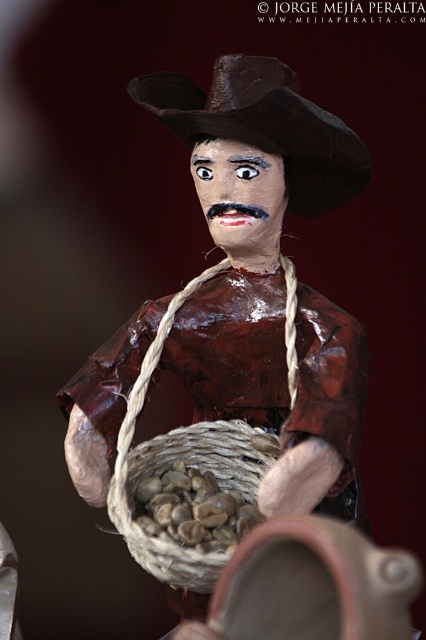
You are an anthropologist studying traditional attire. You observe the matte brown figure at center and the brown paper cowboy hat at center in the image. Which object is taller?

The matte brown figure at center is taller than the brown paper cowboy hat at center.